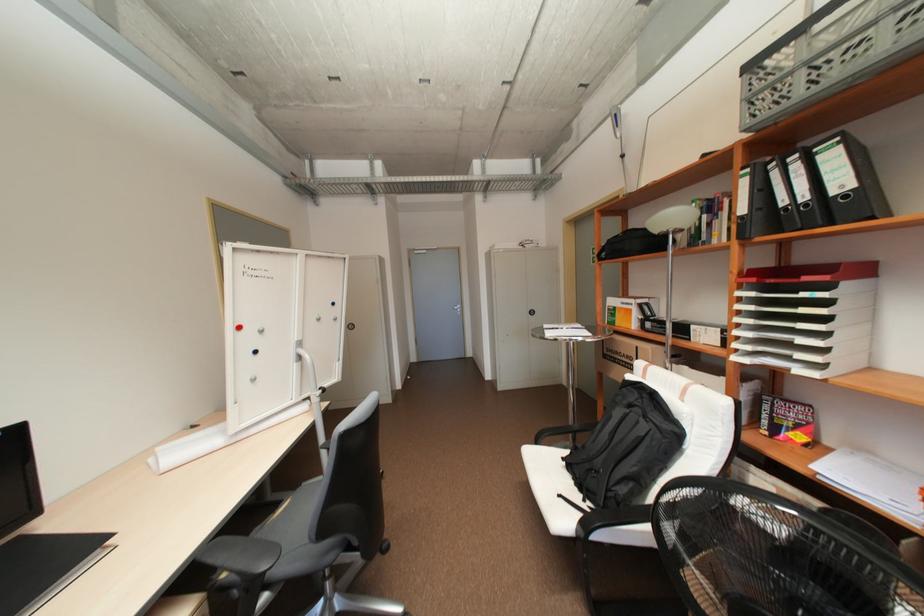
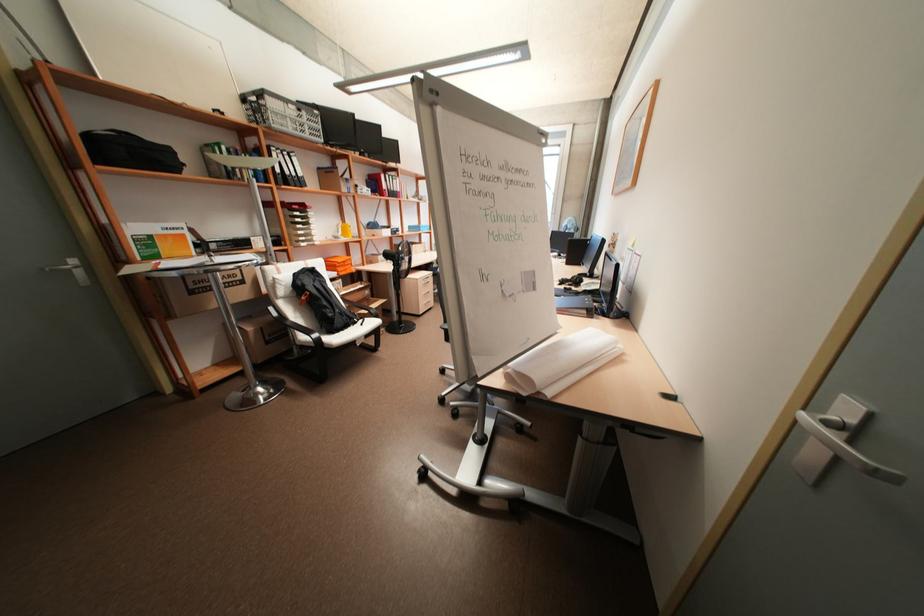
Find the pixel in the second image that matches point 636,406 in the first image.

(320, 281)